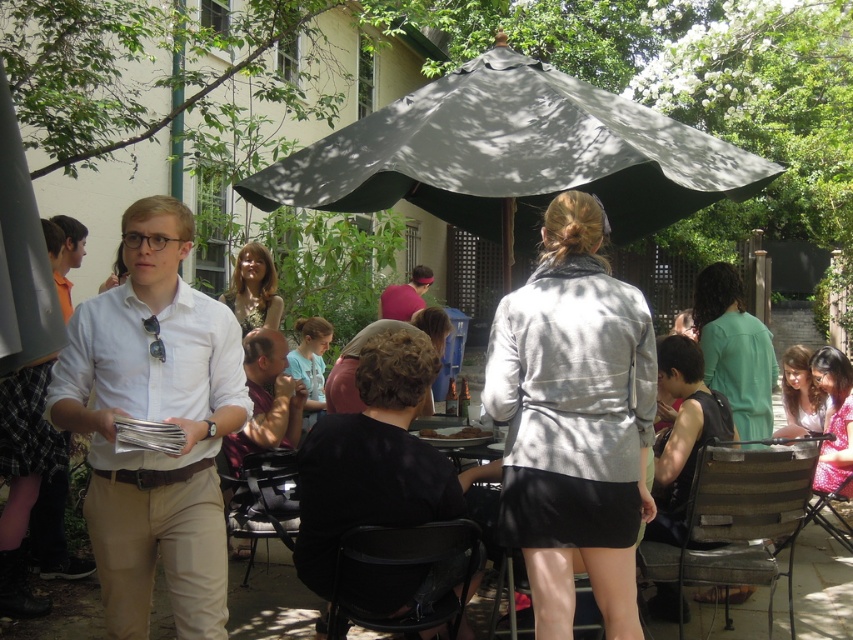
You are standing in the outdoor gathering area and want to determine which of the two points, point (165, 301) or point (780, 428), is nearer to you. Based on the scene description, which point is closer?

Point (165, 301) is closer to the viewer than point (780, 428).

Based on the photo, you are a photographer positioned at the back of the scene. You want to take a photo that includes both the white matte shirt at center and the light brown hair at lower right. Which object should you adjust your camera angle to focus on first to ensure both are in frame?

The white matte shirt at center is closer to the viewer than the light brown hair at lower right. To ensure both are in frame, adjust your camera angle to focus on the white matte shirt at center first, then include the light brown hair at lower right in the background.